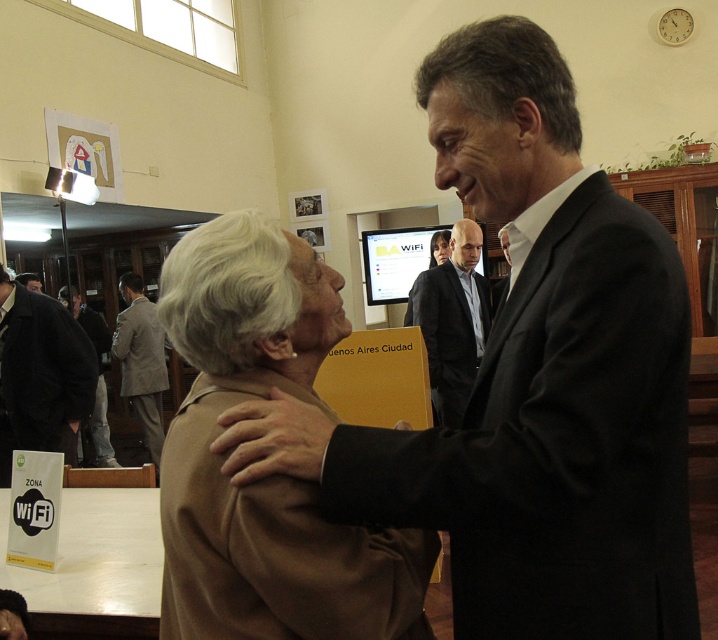
Question: Is the position of black suit at center less distant than that of light brown suit at center?

Choices:
 (A) no
 (B) yes

Answer: (B)

Question: Based on their relative distances, which object is farther from the brown leather jacket at lower left?

Choices:
 (A) black leather jacket at left
 (B) black suit at center
 (C) light brown suit at center

Answer: (B)

Question: Estimate the real-world distances between objects in this image. Which object is farther from the light brown suit at center?

Choices:
 (A) brown leather jacket at lower left
 (B) dark suit jacket at center

Answer: (B)

Question: Is black suit at center to the right of black leather jacket at left from the viewer's perspective?

Choices:
 (A) no
 (B) yes

Answer: (B)

Question: In this image, where is black suit at center located relative to light brown suit at center?

Choices:
 (A) right
 (B) left

Answer: (A)

Question: Which object is positioned closest to the light brown suit at center?

Choices:
 (A) black leather jacket at left
 (B) brown woolen coat at center

Answer: (A)